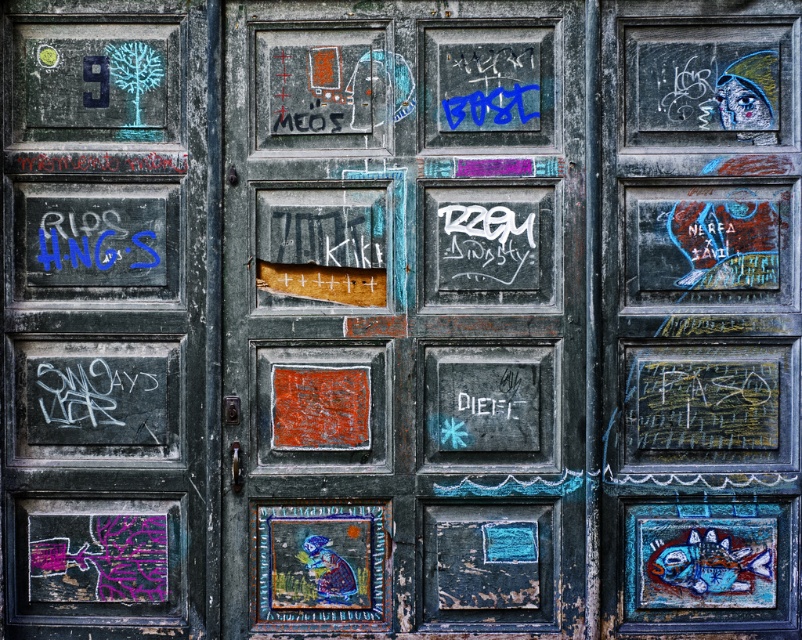
Question: Which of the following is the closest to the observer?

Choices:
 (A) (47, 13)
 (B) (371, 134)

Answer: (B)

Question: Is rusty metal door at center behind chalky green door at left?

Choices:
 (A) no
 (B) yes

Answer: (A)

Question: Is rusty metal door at center to the left of chalky green door at left from the viewer's perspective?

Choices:
 (A) no
 (B) yes

Answer: (A)

Question: Does rusty metal door at center appear on the right side of chalky green door at left?

Choices:
 (A) no
 (B) yes

Answer: (B)

Question: Which of the following is the closest to the observer?

Choices:
 (A) rusty metal door at center
 (B) chalky green door at left

Answer: (A)